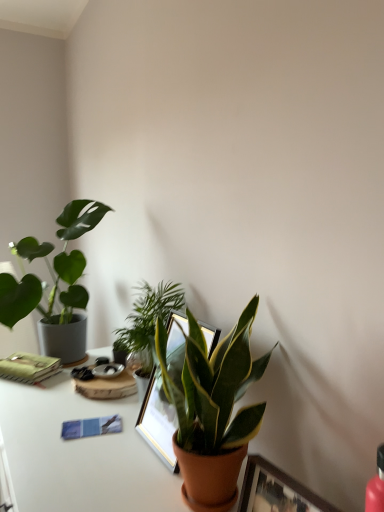
Image resolution: width=384 pixels, height=512 pixels. In order to click on vacant region to the left of green matte plant at center, the 1th houseplant positioned from the front in this screenshot , I will do `click(115, 474)`.